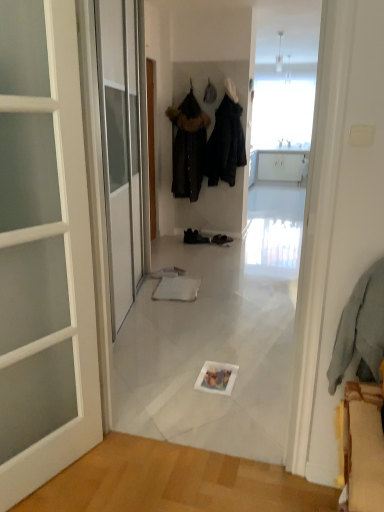
Image resolution: width=384 pixels, height=512 pixels. What do you see at coordinates (221, 239) in the screenshot?
I see `black leather shoes at center, which ranks as the first footwear in right-to-left order` at bounding box center [221, 239].

Identify the location of dark brown fur-trimmed coat at center, the 1th clothing positioned from the back. (188, 146).

The image size is (384, 512). Describe the element at coordinates (360, 327) in the screenshot. I see `light blue fabric at right, acting as the 1th clothing starting from the front` at that location.

The height and width of the screenshot is (512, 384). I want to click on black leather shoes at center, the second footwear when ordered from right to left, so click(195, 237).

You are a GUI agent. You are given a task and a screenshot of the screen. Output one action in this format:
    pyautogui.click(x=<x>, y=<y>)
    Task: Click on the black leather shoes at center, which appears as the second footwear when viewed from the left
    
    Given the screenshot: What is the action you would take?
    pyautogui.click(x=221, y=239)

From a real-world perspective, does light blue fabric at right, acting as the 1th clothing starting from the front, sit lower than black leather shoes at center, which appears as the second footwear when viewed from the left?

No, from a real-world perspective, light blue fabric at right, acting as the 1th clothing starting from the front, is not below black leather shoes at center, which appears as the second footwear when viewed from the left.

Is light blue fabric at right, acting as the 1th clothing starting from the front, in front of or behind black leather shoes at center, which ranks as the first footwear in right-to-left order, in the image?

Visually, light blue fabric at right, acting as the 1th clothing starting from the front, is located in front of black leather shoes at center, which ranks as the first footwear in right-to-left order.

Would you say dark brown fur-trimmed coat at center, positioned as the third clothing in front-to-back order, is a long distance from black leather shoes at center, the second footwear when ordered from right to left?

Actually, dark brown fur-trimmed coat at center, positioned as the third clothing in front-to-back order, and black leather shoes at center, the second footwear when ordered from right to left, are a little close together.

Is dark brown fur-trimmed coat at center, the 1th clothing positioned from the back, situated inside black leather shoes at center, which is the first footwear from left to right, or outside?

The correct answer is: outside.

Does dark brown fur-trimmed coat at center, the 1th clothing positioned from the back, turn towards black leather shoes at center, which is the first footwear from left to right?

No, dark brown fur-trimmed coat at center, the 1th clothing positioned from the back, is not oriented towards black leather shoes at center, which is the first footwear from left to right.

Is black fabric coat at center, arranged as the second clothing when viewed from the front, bigger than light blue fabric at right, which appears as the 3th clothing when viewed from the back?

Indeed, black fabric coat at center, arranged as the second clothing when viewed from the front, has a larger size compared to light blue fabric at right, which appears as the 3th clothing when viewed from the back.

Considering the relative sizes of black fabric coat at center, which is counted as the second clothing, starting from the back, and light blue fabric at right, which appears as the 3th clothing when viewed from the back, in the image provided, is black fabric coat at center, which is counted as the second clothing, starting from the back, thinner than light blue fabric at right, which appears as the 3th clothing when viewed from the back,?

No.

Based on the photo, considering the sizes of objects black fabric coat at center, arranged as the second clothing when viewed from the front, and light blue fabric at right, which appears as the 3th clothing when viewed from the back, in the image provided, who is shorter, black fabric coat at center, arranged as the second clothing when viewed from the front, or light blue fabric at right, which appears as the 3th clothing when viewed from the back,?

light blue fabric at right, which appears as the 3th clothing when viewed from the back.

The image size is (384, 512). I want to click on clothing on the right of the black fabric coat at center, which is counted as the second clothing, starting from the back, so click(360, 327).

Which object is wider, black leather shoes at center, the second footwear when ordered from right to left, or black leather shoes at center, which ranks as the first footwear in right-to-left order?

Wider between the two is black leather shoes at center, which ranks as the first footwear in right-to-left order.

Is black leather shoes at center, the second footwear when ordered from right to left, not within black leather shoes at center, which ranks as the first footwear in right-to-left order?

That's correct, black leather shoes at center, the second footwear when ordered from right to left, is outside of black leather shoes at center, which ranks as the first footwear in right-to-left order.

Locate an element on the screen. The height and width of the screenshot is (512, 384). footwear located underneath the black leather shoes at center, the second footwear when ordered from right to left (from a real-world perspective) is located at coordinates (221, 239).

Is black leather shoes at center, which is the first footwear from left to right, in front of or behind black leather shoes at center, which ranks as the first footwear in right-to-left order, in the image?

In the image, black leather shoes at center, which is the first footwear from left to right, appears behind black leather shoes at center, which ranks as the first footwear in right-to-left order.

From the image's perspective, is black leather shoes at center, the second footwear when ordered from right to left, on top of dark brown fur-trimmed coat at center, the 1th clothing positioned from the back?

No.

What's the angular difference between black leather shoes at center, the second footwear when ordered from right to left, and dark brown fur-trimmed coat at center, the 1th clothing positioned from the back,'s facing directions?

12.4 degrees.

I want to click on the 1st footwear positioned below the dark brown fur-trimmed coat at center, the 1th clothing positioned from the back (from the image's perspective), so click(195, 237).

Is black leather shoes at center, which is the first footwear from left to right, positioned with its back to dark brown fur-trimmed coat at center, positioned as the third clothing in front-to-back order?

No, black leather shoes at center, which is the first footwear from left to right, is not facing away from dark brown fur-trimmed coat at center, positioned as the third clothing in front-to-back order.

From the image's perspective, between light blue fabric at right, acting as the 1th clothing starting from the front, and black fabric coat at center, arranged as the second clothing when viewed from the front, who is located below?

light blue fabric at right, acting as the 1th clothing starting from the front, appears lower in the image.

Is light blue fabric at right, acting as the 1th clothing starting from the front, positioned with its back to black fabric coat at center, which is counted as the second clothing, starting from the back?

No.

Does light blue fabric at right, which appears as the 3th clothing when viewed from the back, come behind black fabric coat at center, which is counted as the second clothing, starting from the back?

No, it is in front of black fabric coat at center, which is counted as the second clothing, starting from the back.

Is light blue fabric at right, which appears as the 3th clothing when viewed from the back, with black fabric coat at center, arranged as the second clothing when viewed from the front?

light blue fabric at right, which appears as the 3th clothing when viewed from the back, is not next to black fabric coat at center, arranged as the second clothing when viewed from the front, and they're not touching.

From the image's perspective, is dark brown fur-trimmed coat at center, the 1th clothing positioned from the back, located above light blue fabric at right, which appears as the 3th clothing when viewed from the back?

Yes.

Is the surface of dark brown fur-trimmed coat at center, positioned as the third clothing in front-to-back order, in direct contact with light blue fabric at right, which appears as the 3th clothing when viewed from the back?

dark brown fur-trimmed coat at center, positioned as the third clothing in front-to-back order, and light blue fabric at right, which appears as the 3th clothing when viewed from the back, are not in contact.

From a real-world perspective, is dark brown fur-trimmed coat at center, the 1th clothing positioned from the back, on top of light blue fabric at right, acting as the 1th clothing starting from the front?

Yes, from a real-world perspective, dark brown fur-trimmed coat at center, the 1th clothing positioned from the back, is above light blue fabric at right, acting as the 1th clothing starting from the front.

Does dark brown fur-trimmed coat at center, positioned as the third clothing in front-to-back order, have a lesser width compared to light blue fabric at right, acting as the 1th clothing starting from the front?

In fact, dark brown fur-trimmed coat at center, positioned as the third clothing in front-to-back order, might be wider than light blue fabric at right, acting as the 1th clothing starting from the front.

At what (x,y) coordinates should I click in order to perform the action: click on the 1st footwear to the left of the light blue fabric at right, acting as the 1th clothing starting from the front, counting from the anchor's position. Please return your answer as a coordinate pair (x, y). The width and height of the screenshot is (384, 512). Looking at the image, I should click on (221, 239).

The image size is (384, 512). In order to click on the 1st clothing above the black leather shoes at center, the second footwear when ordered from right to left (from the image's perspective) in this screenshot , I will do `click(188, 146)`.

Estimate the real-world distances between objects in this image. Which object is further from black fabric coat at center, arranged as the second clothing when viewed from the front, light blue fabric at right, acting as the 1th clothing starting from the front, or dark brown fur-trimmed coat at center, positioned as the third clothing in front-to-back order?

Among the two, light blue fabric at right, acting as the 1th clothing starting from the front, is located further to black fabric coat at center, arranged as the second clothing when viewed from the front.

Considering their positions, is dark brown fur-trimmed coat at center, positioned as the third clothing in front-to-back order, positioned closer to black leather shoes at center, which appears as the second footwear when viewed from the left, than black leather shoes at center, the second footwear when ordered from right to left?

black leather shoes at center, the second footwear when ordered from right to left.

Looking at the image, which one is located closer to dark brown fur-trimmed coat at center, positioned as the third clothing in front-to-back order, light blue fabric at right, acting as the 1th clothing starting from the front, or black fabric coat at center, which is counted as the second clothing, starting from the back?

black fabric coat at center, which is counted as the second clothing, starting from the back.

Based on their spatial positions, is black leather shoes at center, which ranks as the first footwear in right-to-left order, or light blue fabric at right, which appears as the 3th clothing when viewed from the back, closer to dark brown fur-trimmed coat at center, positioned as the third clothing in front-to-back order?

The object closer to dark brown fur-trimmed coat at center, positioned as the third clothing in front-to-back order, is black leather shoes at center, which ranks as the first footwear in right-to-left order.

From the image, which object appears to be farther from light blue fabric at right, which appears as the 3th clothing when viewed from the back, black leather shoes at center, the second footwear when ordered from right to left, or black fabric coat at center, arranged as the second clothing when viewed from the front?

black fabric coat at center, arranged as the second clothing when viewed from the front.

Estimate the real-world distances between objects in this image. Which object is further from light blue fabric at right, which appears as the 3th clothing when viewed from the back, black leather shoes at center, which is the first footwear from left to right, or black leather shoes at center, which ranks as the first footwear in right-to-left order?

black leather shoes at center, which is the first footwear from left to right, is further to light blue fabric at right, which appears as the 3th clothing when viewed from the back.

In the scene shown: Considering their positions, is black fabric coat at center, which is counted as the second clothing, starting from the back, positioned further to dark brown fur-trimmed coat at center, positioned as the third clothing in front-to-back order, than black leather shoes at center, the second footwear when ordered from right to left?

black leather shoes at center, the second footwear when ordered from right to left, lies further to dark brown fur-trimmed coat at center, positioned as the third clothing in front-to-back order, than the other object.

Estimate the real-world distances between objects in this image. Which object is further from black leather shoes at center, the second footwear when ordered from right to left, black fabric coat at center, which is counted as the second clothing, starting from the back, or black leather shoes at center, which appears as the second footwear when viewed from the left?

black fabric coat at center, which is counted as the second clothing, starting from the back, is positioned further to the anchor black leather shoes at center, the second footwear when ordered from right to left.

Locate an element on the screen. clothing between light blue fabric at right, which appears as the 3th clothing when viewed from the back, and dark brown fur-trimmed coat at center, positioned as the third clothing in front-to-back order, in the front-back direction is located at coordinates (225, 144).

Find the location of a particular element. This screenshot has width=384, height=512. clothing between black fabric coat at center, arranged as the second clothing when viewed from the front, and black leather shoes at center, which ranks as the first footwear in right-to-left order, in the vertical direction is located at coordinates (188, 146).

This screenshot has width=384, height=512. I want to click on footwear between light blue fabric at right, acting as the 1th clothing starting from the front, and black leather shoes at center, the second footwear when ordered from right to left, along the z-axis, so click(221, 239).

This screenshot has height=512, width=384. In order to click on clothing between black fabric coat at center, which is counted as the second clothing, starting from the back, and black leather shoes at center, which is the first footwear from left to right, from top to bottom in this screenshot , I will do `click(188, 146)`.